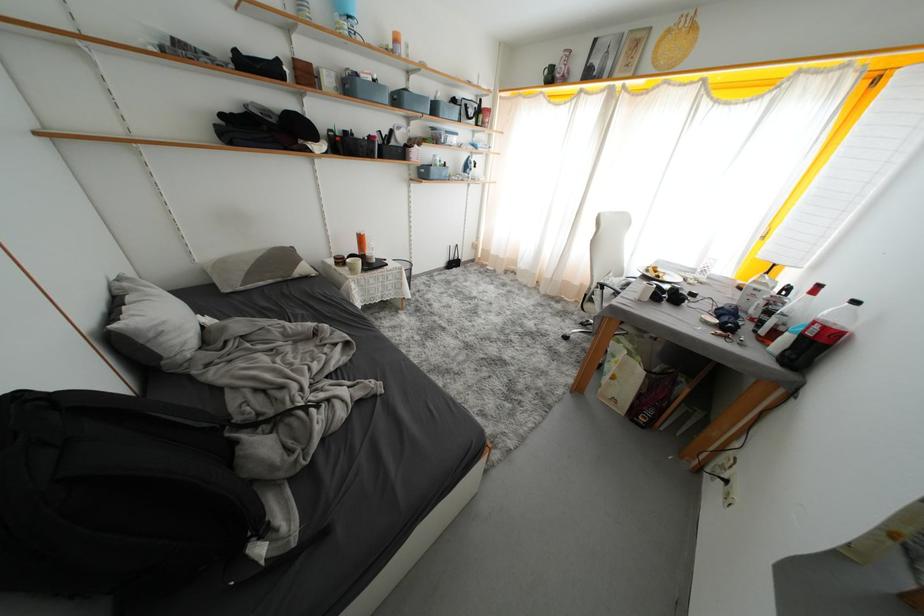
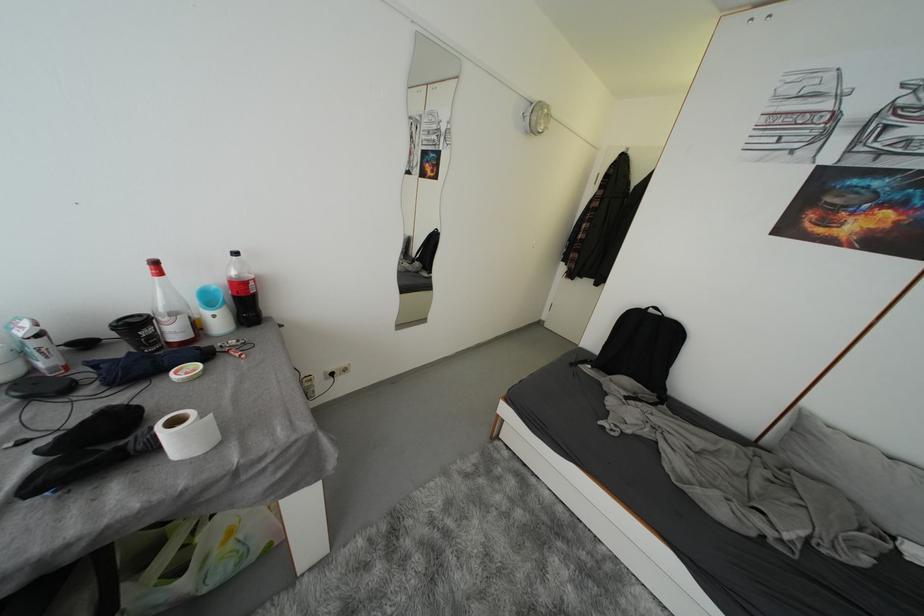
Find the pixel in the second image that matches (x=861, y=306) in the first image.

(242, 257)